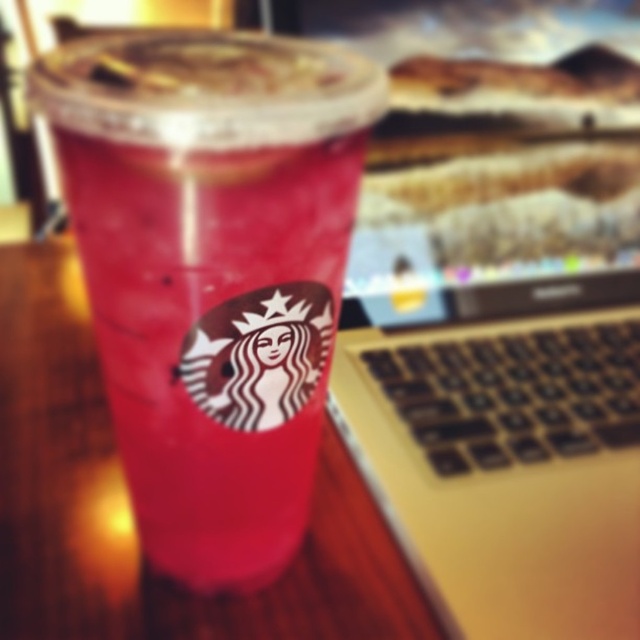
You are looking at the scene and want to place a sticker exactly halfway between the two points, point (x=461, y=314) and point (x=81, y=241). Given that the scene is on a flat surface, will the sticker be closer to the viewer or farther away compared to the Starbucks cup?

The sticker placed halfway between point (x=461, y=314) and point (x=81, y=241) would be closer to the viewer than the Starbucks cup because point (x=461, y=314) is further to the viewer than point (x=81, y=241), so the midpoint would be between them, but since one is closer and one is farther, the average would still be closer than the farther point. However, since the Starbucks cup is part of the scene, its position relative to the points isn

You are organizing items on a desk and see the silver metallic laptop at center and the pink paper cup at center. Which item is covering part of the other?

The silver metallic laptop at center is positioned over the pink paper cup at center, so the laptop is covering part of the cup.

You are setting up a workspace on a narrow desk. You have a silver metallic laptop at center and a pink paper cup at center. Which object requires more horizontal space to place on the desk?

The silver metallic laptop at center requires more horizontal space because its width surpasses that of the pink paper cup at center.